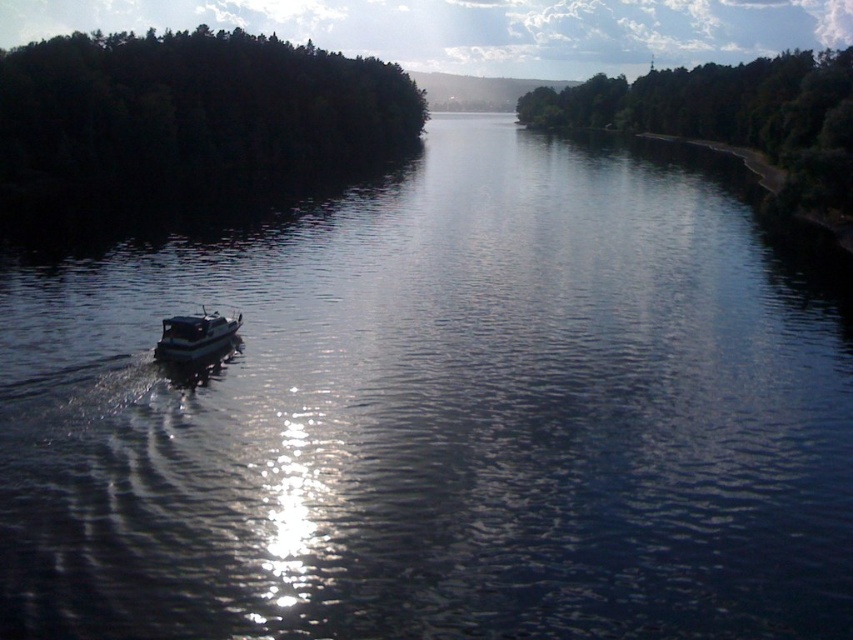
From the picture: Is dark green forest at upper left shorter than white glossy boat at lower left?

No.

Which is below, dark green forest at upper left or white glossy boat at lower left?

white glossy boat at lower left

Between point (244, 74) and point (228, 316), which one is positioned in front?

Point (228, 316) is more forward.

Identify the location of dark green forest at upper left. (190, 109).

Can you confirm if green leafy trees at right is wider than white glossy boat at lower left?

Correct, the width of green leafy trees at right exceeds that of white glossy boat at lower left.

Between green leafy trees at right and white glossy boat at lower left, which one appears on the right side from the viewer's perspective?

green leafy trees at right

Locate an element on the screen. This screenshot has width=853, height=640. green leafy trees at right is located at coordinates (730, 113).

Who is positioned more to the left, dark green forest at upper left or green leafy trees at right?

dark green forest at upper left

What do you see at coordinates (190, 109) in the screenshot? The image size is (853, 640). I see `dark green forest at upper left` at bounding box center [190, 109].

Locate an element on the screen. The width and height of the screenshot is (853, 640). dark green forest at upper left is located at coordinates (190, 109).